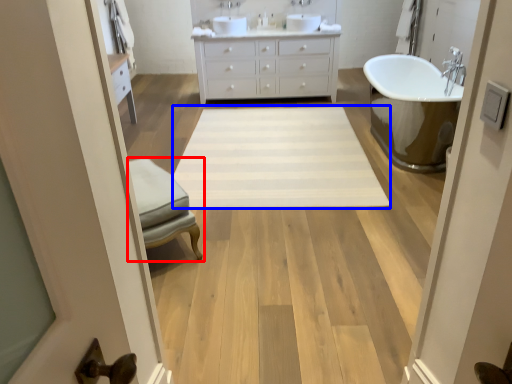
Question: Which of the following is the closest to the observer, furniture (highlighted by a red box) or plain (highlighted by a blue box)?

Choices:
 (A) furniture
 (B) plain

Answer: (A)